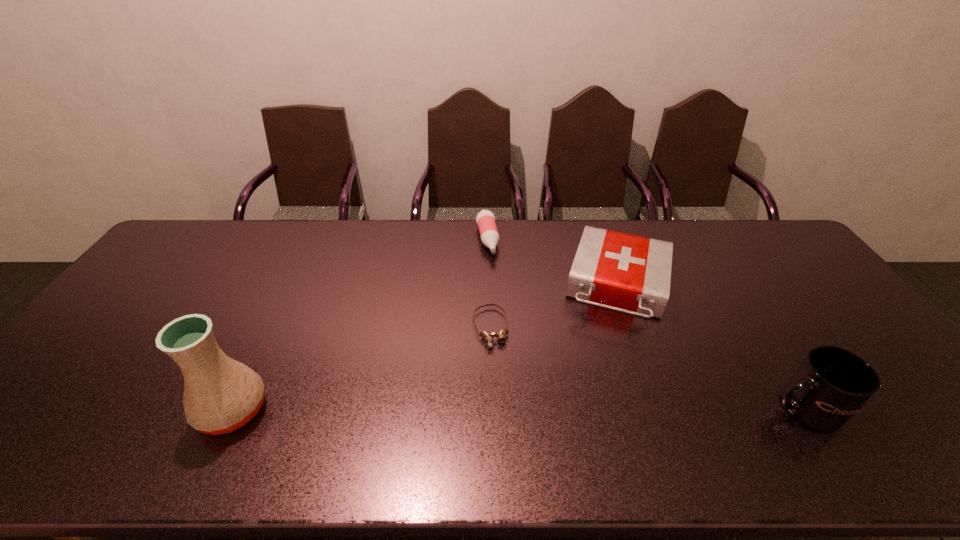
This screenshot has width=960, height=540. Identify the location of free space between the goggles and the tallest object. (362, 369).

Select which object appears as the second closest to the tallest object. Please provide its 2D coordinates. Your answer should be formatted as a tuple, i.e. [(x, y)], where the tuple contains the x and y coordinates of a point satisfying the conditions above.

[(485, 219)]

Identify the location of object that is the second closest one to the rightmost object. (501, 335).

Image resolution: width=960 pixels, height=540 pixels. In order to click on vacant point that satisfies the following two spatial constraints: 1. on the front side of the fourth shortest object; 2. with the handle on the side of the shortest object in this screenshot , I will do tap(492, 408).

Identify the location of vacant space that satisfies the following two spatial constraints: 1. on the front side of the mug; 2. with the handle on the side of the bottle. The height and width of the screenshot is (540, 960). (491, 408).